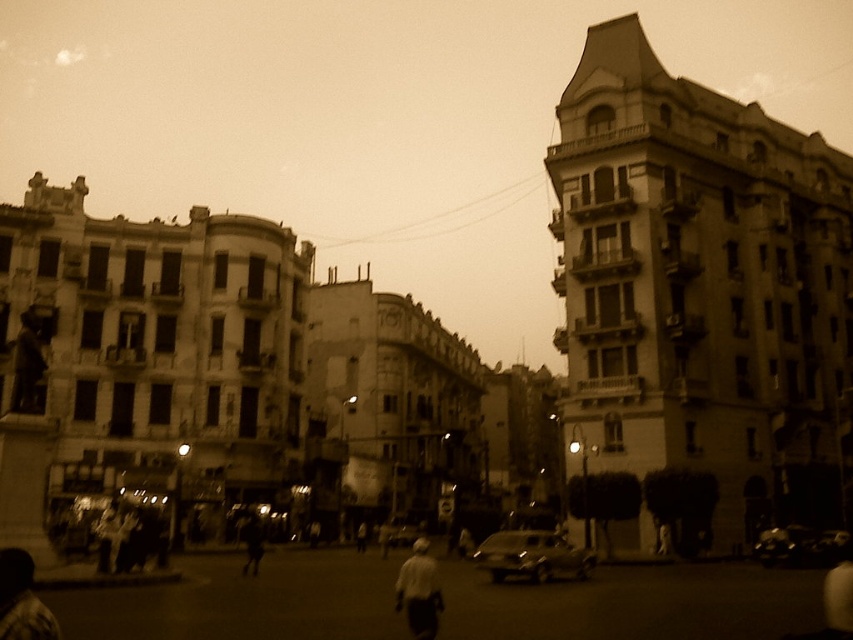
Does metallic silver car at center have a greater width compared to shiny black car at center?

No, metallic silver car at center is not wider than shiny black car at center.

Is point (518, 531) positioned before point (842, 536)?

Yes, it is.

This screenshot has height=640, width=853. What do you see at coordinates (531, 556) in the screenshot?
I see `metallic silver car at center` at bounding box center [531, 556].

You are a GUI agent. You are given a task and a screenshot of the screen. Output one action in this format:
    pyautogui.click(x=<x>, y=<y>)
    Task: Click on the metallic silver car at center
    
    Given the screenshot: What is the action you would take?
    pyautogui.click(x=531, y=556)

Can you confirm if metallic silver car at center is bigger than white matte shirt at center?

Correct, metallic silver car at center is larger in size than white matte shirt at center.

Does point (555, 564) lie behind point (426, 609)?

Yes, it is behind point (426, 609).

Find the location of a particular element. metallic silver car at center is located at coordinates (531, 556).

Is point (503, 570) behind point (254, 545)?

No, it is in front of (254, 545).

Between point (535, 557) and point (247, 573), which one is positioned behind?

The point (247, 573) is more distant.

Measure the distance between metallic silver car at center and camera.

metallic silver car at center and camera are 58.24 meters apart.

Image resolution: width=853 pixels, height=640 pixels. What are the coordinates of `metallic silver car at center` in the screenshot? It's located at (531, 556).